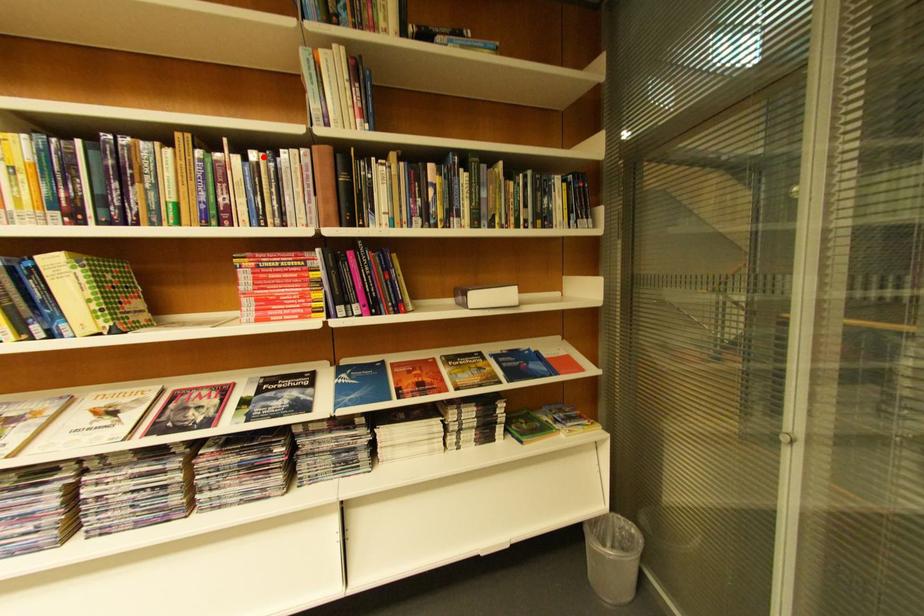
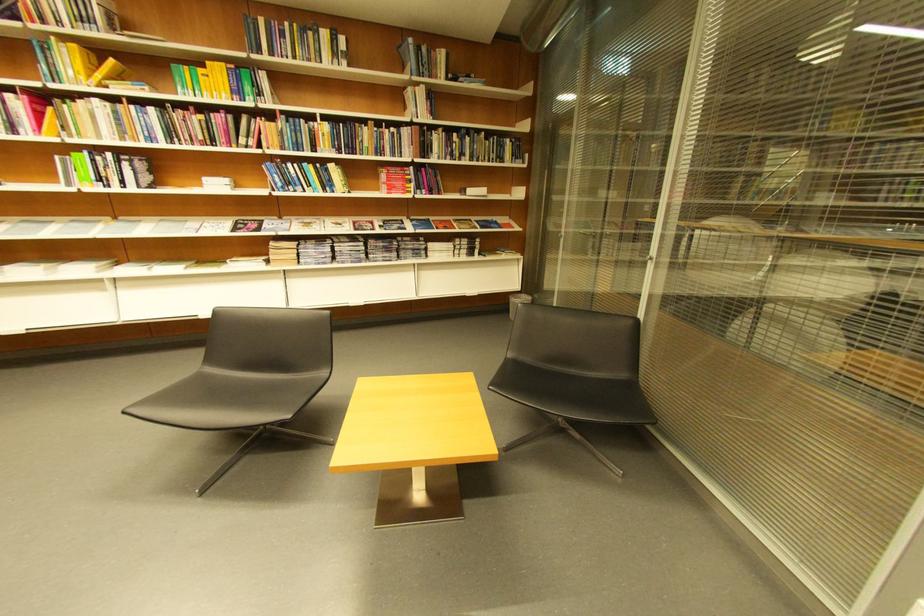
Question: I am providing you with two images of the same scene from different viewpoints. In image1, a red point is highlighted. Considering the same 3D point in image2, which of the following is correct?

Choices:
 (A) It is closer
 (B) It is farther

Answer: (A)